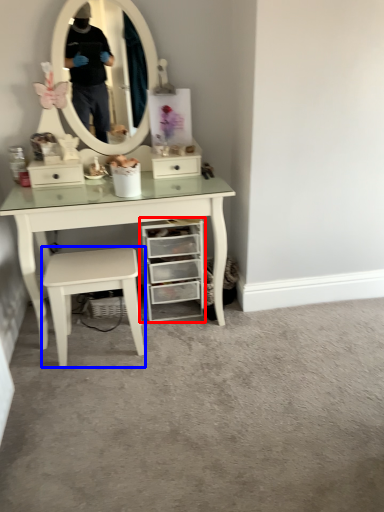
Question: Which object appears closest to the camera in this image, chest of drawers (highlighted by a red box) or stool (highlighted by a blue box)?

Choices:
 (A) chest of drawers
 (B) stool

Answer: (B)